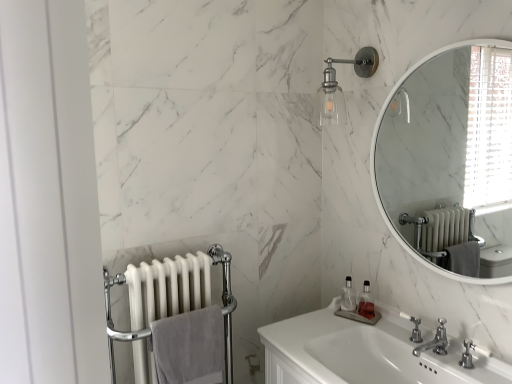
I want to click on vacant space behind clear plastic soap dispenser at lower center, which is the second soap dispenser in right-to-left order, so click(x=344, y=307).